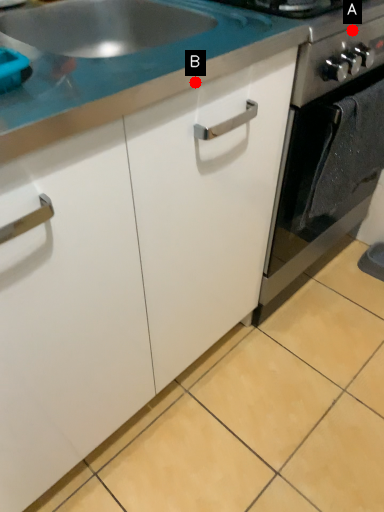
Question: Two points are circled on the image, labeled by A and B beside each circle. Which point is closer to the camera?

Choices:
 (A) A is closer
 (B) B is closer

Answer: (B)